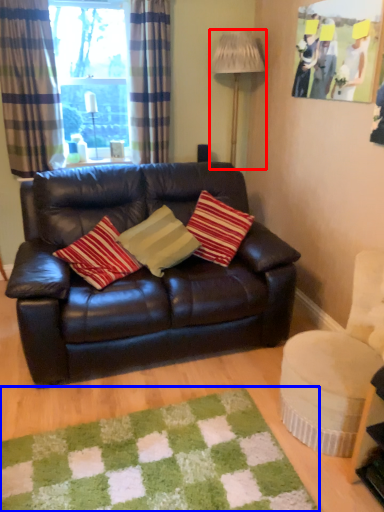
Question: Among these objects, which one is farthest to the camera, lamp (highlighted by a red box) or mat (highlighted by a blue box)?

Choices:
 (A) lamp
 (B) mat

Answer: (A)